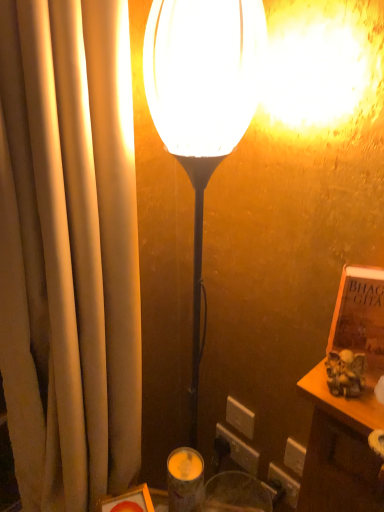
Question: Would you consider brown leather book at right to be distant from matte glass candle holder at lower center?

Choices:
 (A) no
 (B) yes

Answer: (A)

Question: Is brown leather book at right taller than matte glass candle holder at lower center?

Choices:
 (A) no
 (B) yes

Answer: (A)

Question: Does brown leather book at right have a lesser width compared to matte glass candle holder at lower center?

Choices:
 (A) no
 (B) yes

Answer: (B)

Question: Can you confirm if brown leather book at right is positioned to the right of matte glass candle holder at lower center?

Choices:
 (A) yes
 (B) no

Answer: (A)

Question: Is brown leather book at right wider than matte glass candle holder at lower center?

Choices:
 (A) yes
 (B) no

Answer: (B)

Question: From the image's perspective, is matte white lamp at center above or below beige fabric curtain at left?

Choices:
 (A) below
 (B) above

Answer: (B)

Question: Based on their sizes in the image, would you say matte white lamp at center is bigger or smaller than beige fabric curtain at left?

Choices:
 (A) small
 (B) big

Answer: (A)

Question: Which is correct: matte white lamp at center is inside beige fabric curtain at left, or outside of it?

Choices:
 (A) inside
 (B) outside

Answer: (B)

Question: Considering the positions of matte white lamp at center and beige fabric curtain at left in the image, is matte white lamp at center wider or thinner than beige fabric curtain at left?

Choices:
 (A) wide
 (B) thin

Answer: (B)

Question: In the image, is matte white lamp at center positioned in front of or behind brown leather book at right?

Choices:
 (A) front
 (B) behind

Answer: (A)

Question: Is matte white lamp at center bigger or smaller than brown leather book at right?

Choices:
 (A) small
 (B) big

Answer: (B)

Question: Based on their positions, is matte white lamp at center located to the left or right of brown leather book at right?

Choices:
 (A) right
 (B) left

Answer: (B)

Question: Looking at their shapes, would you say matte white lamp at center is wider or thinner than brown leather book at right?

Choices:
 (A) wide
 (B) thin

Answer: (A)

Question: In terms of width, does white plastic electric outlet at lower center, the first electric outlet in the top-to-bottom sequence, look wider or thinner when compared to beige fabric curtain at left?

Choices:
 (A) wide
 (B) thin

Answer: (B)

Question: From a real-world perspective, is white plastic electric outlet at lower center, the first electric outlet in the top-to-bottom sequence, physically located above or below beige fabric curtain at left?

Choices:
 (A) below
 (B) above

Answer: (A)